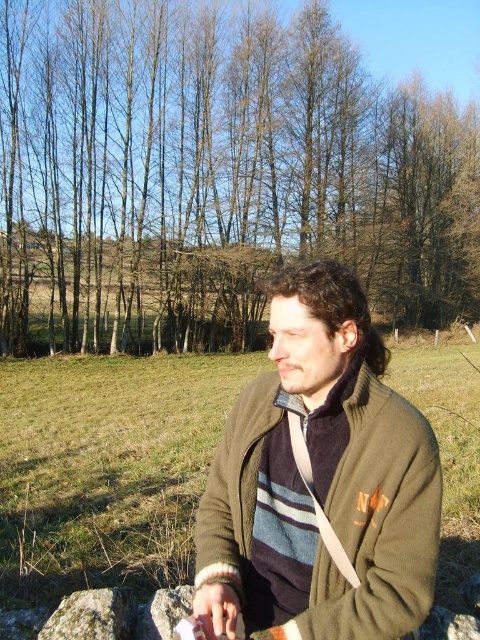
Does brown bark tree at upper center come behind green mossy rock at lower left?

Yes.

Consider the image. Which is below, brown bark tree at upper center or green mossy rock at lower left?

green mossy rock at lower left is below.

Who is more forward, (48, 19) or (84, 596)?

Point (84, 596)

Where is `brown bark tree at upper center`? The height and width of the screenshot is (640, 480). brown bark tree at upper center is located at coordinates (216, 173).

Based on the photo, can you confirm if brown bark tree at upper center is wider than green fuzzy sweater at center?

Yes, brown bark tree at upper center is wider than green fuzzy sweater at center.

Looking at this image, does brown bark tree at upper center appear on the left side of green fuzzy sweater at center?

In fact, brown bark tree at upper center is to the right of green fuzzy sweater at center.

Is point (460, 176) more distant than point (321, 296)?

Yes, point (460, 176) is farther from viewer.

Identify the location of brown bark tree at upper center. (216, 173).

Is green fuzzy sweater at center in front of green mossy rock at lower left?

Yes, it is.

Can you confirm if green fuzzy sweater at center is taller than green mossy rock at lower left?

Yes, green fuzzy sweater at center is taller than green mossy rock at lower left.

This screenshot has height=640, width=480. I want to click on green fuzzy sweater at center, so click(x=320, y=481).

Image resolution: width=480 pixels, height=640 pixels. In order to click on green fuzzy sweater at center in this screenshot , I will do `click(320, 481)`.